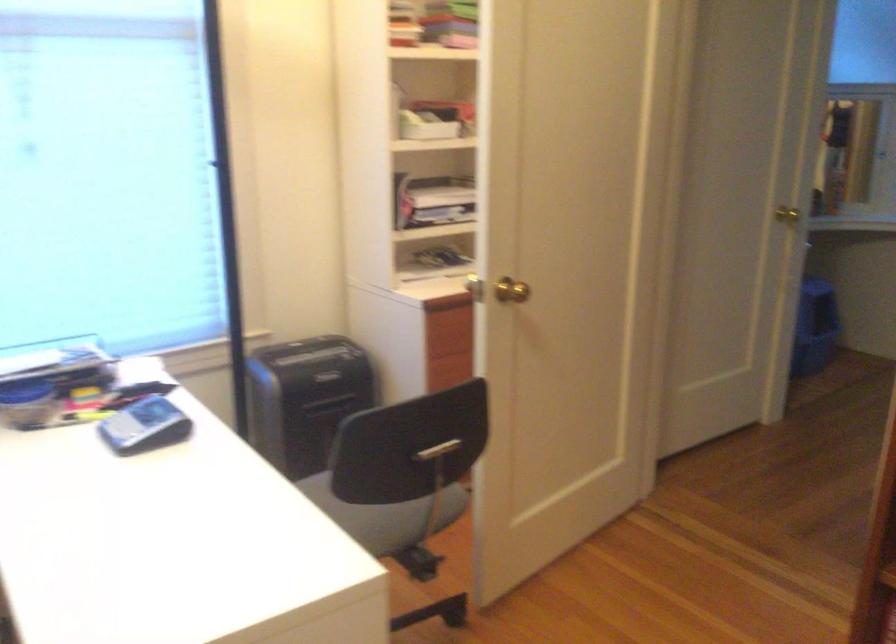
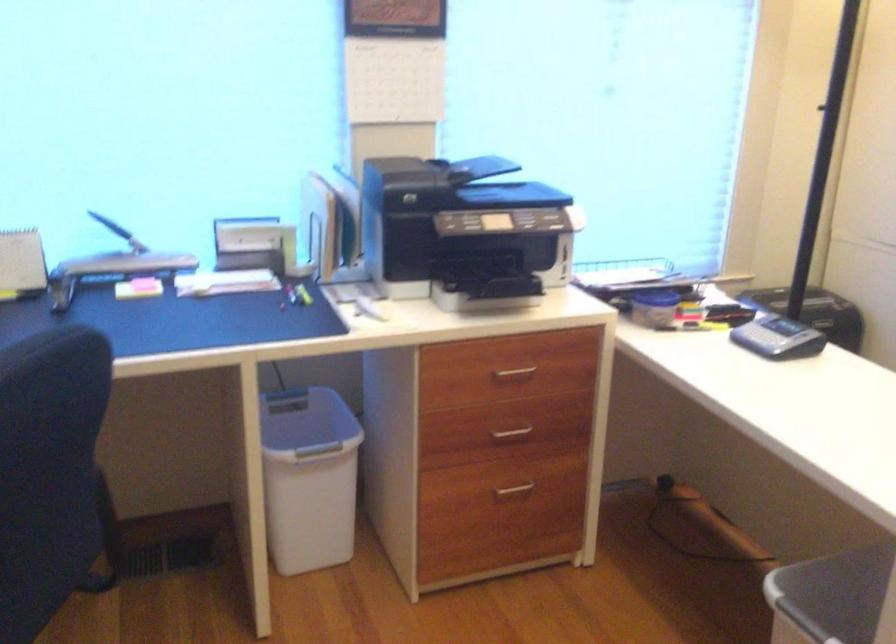
Find the pixel in the second image that matches (143,430) in the first image.

(778, 337)